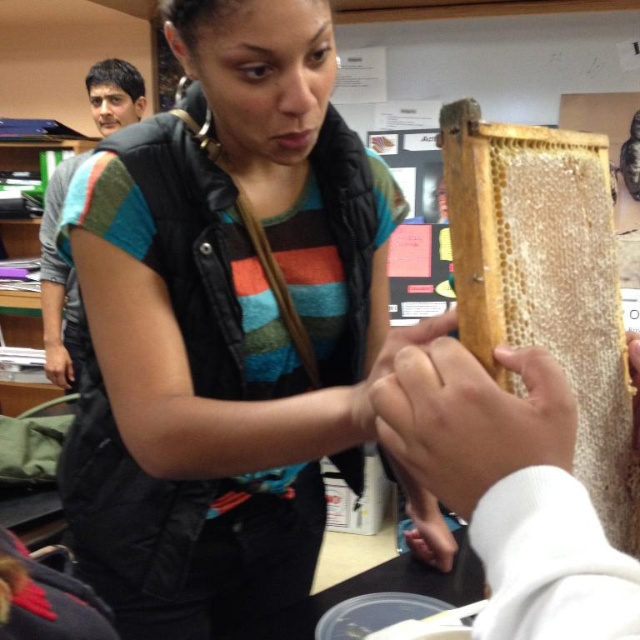
Question: Considering the real-world distances, which object is farthest from the smooth skin at center?

Choices:
 (A) matte black vest at center
 (B) natural honeycomb at upper right

Answer: (A)

Question: From the image, what is the correct spatial relationship of matte black vest at center in relation to smooth skin at center?

Choices:
 (A) right
 (B) left

Answer: (B)

Question: Which of the following is the closest to the observer?

Choices:
 (A) (440, 497)
 (B) (236, 161)

Answer: (A)

Question: Which point is farther from the camera taking this photo?

Choices:
 (A) (515, 236)
 (B) (88, 284)

Answer: (B)

Question: Does matte black vest at center have a greater width compared to natural honeycomb at upper right?

Choices:
 (A) yes
 (B) no

Answer: (A)

Question: Is natural honeycomb at upper right positioned behind smooth skin at center?

Choices:
 (A) no
 (B) yes

Answer: (B)